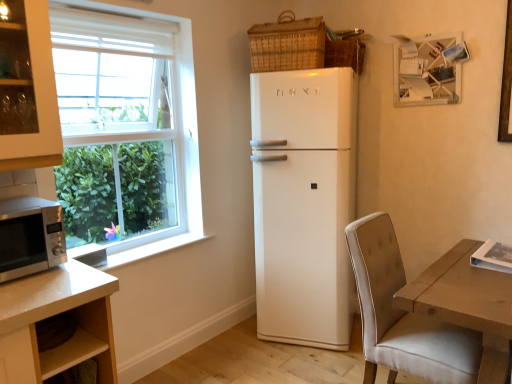
Question: Is satin silver microwave at lower left taller than white glossy refrigerator at center?

Choices:
 (A) no
 (B) yes

Answer: (A)

Question: Can you confirm if satin silver microwave at lower left is shorter than white glossy refrigerator at center?

Choices:
 (A) no
 (B) yes

Answer: (B)

Question: Would you say satin silver microwave at lower left is a long distance from white glossy refrigerator at center?

Choices:
 (A) yes
 (B) no

Answer: (A)

Question: Is satin silver microwave at lower left smaller than white glossy refrigerator at center?

Choices:
 (A) yes
 (B) no

Answer: (A)

Question: Considering the relative positions of satin silver microwave at lower left and white glossy refrigerator at center in the image provided, is satin silver microwave at lower left behind white glossy refrigerator at center?

Choices:
 (A) no
 (B) yes

Answer: (A)

Question: From a real-world perspective, is satin silver microwave at lower left located beneath white glossy refrigerator at center?

Choices:
 (A) yes
 (B) no

Answer: (B)

Question: Could you tell me if woven wicker basket at upper right, the 2th basket from the left, is turned towards satin silver microwave at lower left?

Choices:
 (A) yes
 (B) no

Answer: (A)

Question: Is woven wicker basket at upper right, the 2th basket from the left, positioned beyond the bounds of satin silver microwave at lower left?

Choices:
 (A) no
 (B) yes

Answer: (B)

Question: From the image's perspective, is woven wicker basket at upper right, the 2th basket from the left, under satin silver microwave at lower left?

Choices:
 (A) yes
 (B) no

Answer: (B)

Question: Is woven wicker basket at upper right, the 2th basket from the left, surrounding satin silver microwave at lower left?

Choices:
 (A) yes
 (B) no

Answer: (B)

Question: Can you confirm if woven wicker basket at upper right, the 2th basket from the left, is taller than satin silver microwave at lower left?

Choices:
 (A) yes
 (B) no

Answer: (B)

Question: Is woven wicker basket at upper right, the 1th basket positioned from the right, shorter than satin silver microwave at lower left?

Choices:
 (A) yes
 (B) no

Answer: (A)

Question: Can you confirm if woven wicker basket at upper right, the 2th basket from the left, is wider than white glossy refrigerator at center?

Choices:
 (A) yes
 (B) no

Answer: (B)